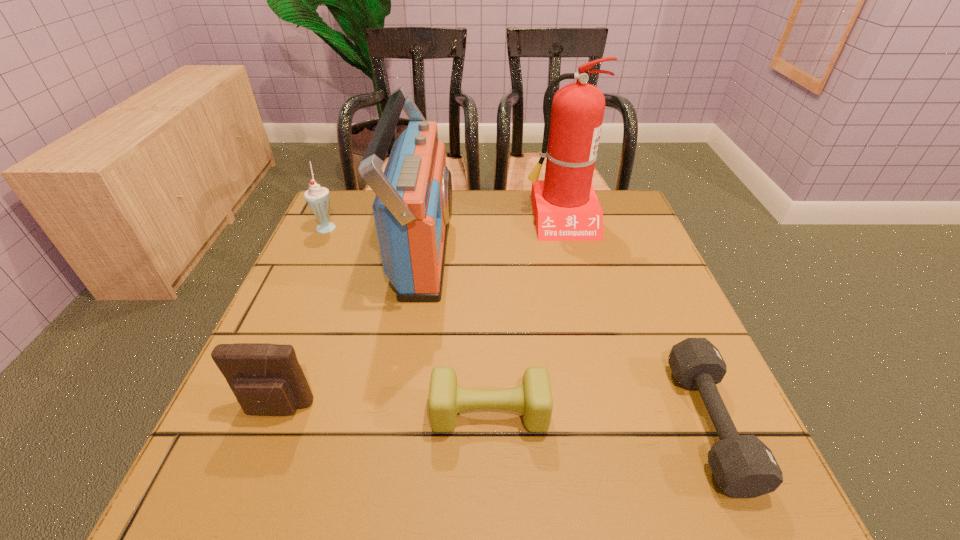
At what (x,y) coordinates should I click in order to perform the action: click on dumbbell positioned at the right edge. Please return your answer as a coordinate pair (x, y). This screenshot has height=540, width=960. Looking at the image, I should click on (743, 466).

You are a GUI agent. You are given a task and a screenshot of the screen. Output one action in this format:
    pyautogui.click(x=<x>, y=<y>)
    Task: Click on the object that is positioned at the far left corner
    The width and height of the screenshot is (960, 540).
    Given the screenshot: What is the action you would take?
    pyautogui.click(x=318, y=198)

Image resolution: width=960 pixels, height=540 pixels. I want to click on object that is positioned at the far right corner, so click(566, 208).

Where is `object positioned at the near right corner`? object positioned at the near right corner is located at coordinates (743, 466).

I want to click on vacant space at the far edge of the desktop, so point(501,199).

The image size is (960, 540). In the image, there is a desktop. What are the coordinates of `vacant area at the near edge` in the screenshot? It's located at (425, 501).

Locate an element on the screen. The image size is (960, 540). free spot at the left edge of the desktop is located at coordinates (280, 330).

Where is `vacant area at the right edge of the desktop`? This screenshot has height=540, width=960. vacant area at the right edge of the desktop is located at coordinates (625, 321).

The width and height of the screenshot is (960, 540). What are the coordinates of `vacant space at the far left corner` in the screenshot? It's located at (366, 190).

You are a GUI agent. You are given a task and a screenshot of the screen. Output one action in this format:
    pyautogui.click(x=<x>, y=<y>)
    Task: Click on the vacant space at the near left corner
    Image resolution: width=960 pixels, height=540 pixels.
    Given the screenshot: What is the action you would take?
    pyautogui.click(x=247, y=458)